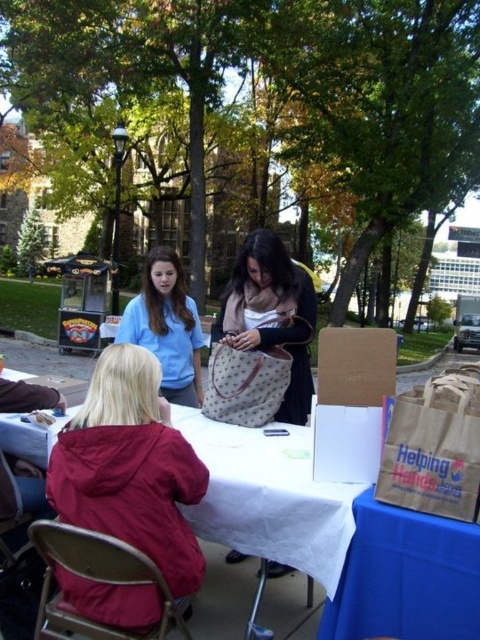
You are planning to set up a small tent at the picnic area. The tent requires a minimum height clearance of 1.8 meters. Given the white fabric picnic table at center and the matte blue shirt at center, which object is more likely to interfere with the tent setup due to height restrictions?

The matte blue shirt at center is taller than the white fabric picnic table at center. Since the tent requires a minimum height clearance of 1.8 meters, the matte blue shirt at center may interfere with the tent setup if its height exceeds the required clearance.

You are standing at the center of the scene and want to locate the matte red jacket at lower left. According to the coordinates provided, in which direction should you look to find it?

The matte red jacket at lower left is located at coordinates point (131, 467), which means you should look to the lower left direction to find it.